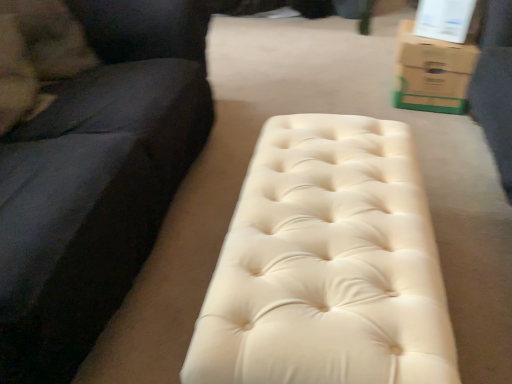
Question: From a real-world perspective, is creamy leather bench at center beneath brown cardboard box at upper right?

Choices:
 (A) yes
 (B) no

Answer: (B)

Question: Is creamy leather bench at center surrounding brown cardboard box at upper right?

Choices:
 (A) no
 (B) yes

Answer: (A)

Question: Is the depth of creamy leather bench at center less than that of brown cardboard box at upper right?

Choices:
 (A) yes
 (B) no

Answer: (A)

Question: Can you confirm if creamy leather bench at center is positioned to the left of brown cardboard box at upper right?

Choices:
 (A) yes
 (B) no

Answer: (A)

Question: Does creamy leather bench at center appear on the right side of brown cardboard box at upper right?

Choices:
 (A) no
 (B) yes

Answer: (A)

Question: Is creamy leather bench at center behind brown cardboard box at upper right?

Choices:
 (A) yes
 (B) no

Answer: (B)

Question: Does creamy leather bench at center have a larger size compared to suede black studio couch at left?

Choices:
 (A) yes
 (B) no

Answer: (B)

Question: Can you confirm if creamy leather bench at center is smaller than suede black studio couch at left?

Choices:
 (A) yes
 (B) no

Answer: (A)

Question: From a real-world perspective, does creamy leather bench at center stand above suede black studio couch at left?

Choices:
 (A) yes
 (B) no

Answer: (B)

Question: Is creamy leather bench at center completely or partially outside of suede black studio couch at left?

Choices:
 (A) yes
 (B) no

Answer: (A)

Question: Is creamy leather bench at center with suede black studio couch at left?

Choices:
 (A) no
 (B) yes

Answer: (A)

Question: Is creamy leather bench at center oriented towards suede black studio couch at left?

Choices:
 (A) yes
 (B) no

Answer: (B)

Question: Can you confirm if brown cardboard box at upper right is thinner than creamy leather bench at center?

Choices:
 (A) no
 (B) yes

Answer: (B)